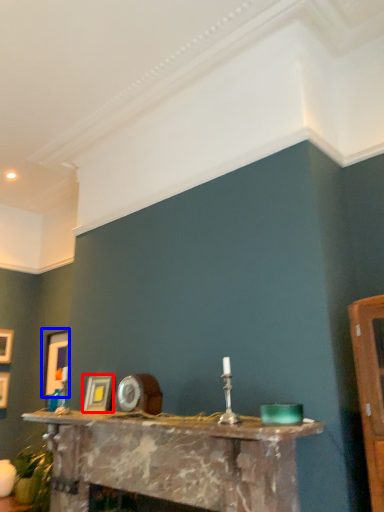
Question: Which point is closer to the camera, picture frame (highlighted by a red box) or picture frame (highlighted by a blue box)?

Choices:
 (A) picture frame
 (B) picture frame

Answer: (A)